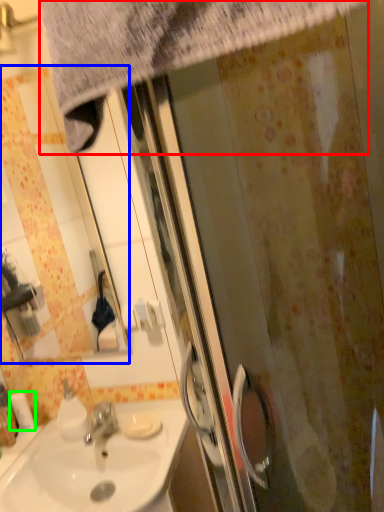
Question: Which object is positioned closest to shower curtain (highlighted by a red box)? Select from mirror (highlighted by a blue box) and toilet paper (highlighted by a green box).

Choices:
 (A) mirror
 (B) toilet paper

Answer: (B)